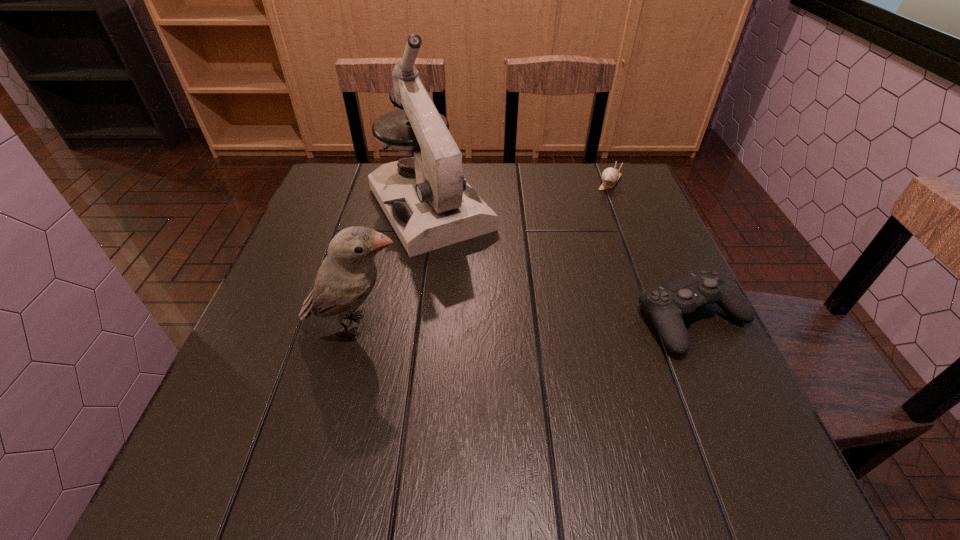
The width and height of the screenshot is (960, 540). What are the coordinates of `empty space between the bird and the microscope` in the screenshot? It's located at click(393, 267).

Where is `vacant space in between the microscope and the bird`? vacant space in between the microscope and the bird is located at coordinates (393, 267).

Find the location of `empty location between the tallest object and the escargot`. empty location between the tallest object and the escargot is located at coordinates (520, 195).

Identify the location of free spot between the escargot and the control. (652, 250).

Where is `vacant space in between the second shortest object and the tallest object`? This screenshot has width=960, height=540. vacant space in between the second shortest object and the tallest object is located at coordinates (562, 264).

The width and height of the screenshot is (960, 540). I want to click on unoccupied position between the control and the microscope, so click(x=562, y=264).

I want to click on object that ranks as the second closest to the bird, so click(666, 304).

You are a GUI agent. You are given a task and a screenshot of the screen. Output one action in this format:
    pyautogui.click(x=<x>, y=<y>)
    Task: Click on the object that is the second closest to the escargot
    
    Given the screenshot: What is the action you would take?
    pyautogui.click(x=666, y=304)